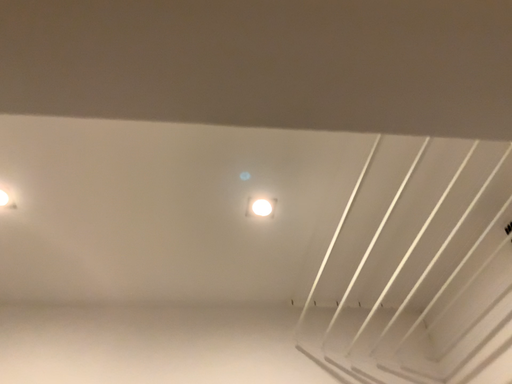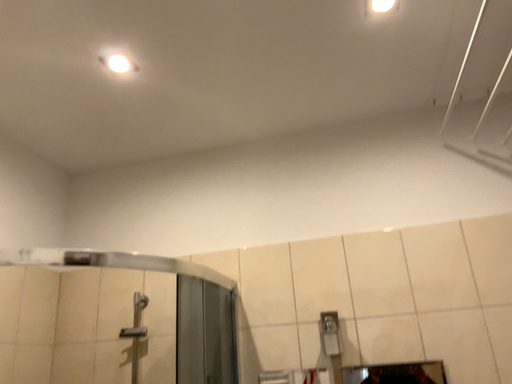
Question: How did the camera likely rotate when shooting the video?

Choices:
 (A) rotated downward
 (B) rotated upward

Answer: (A)